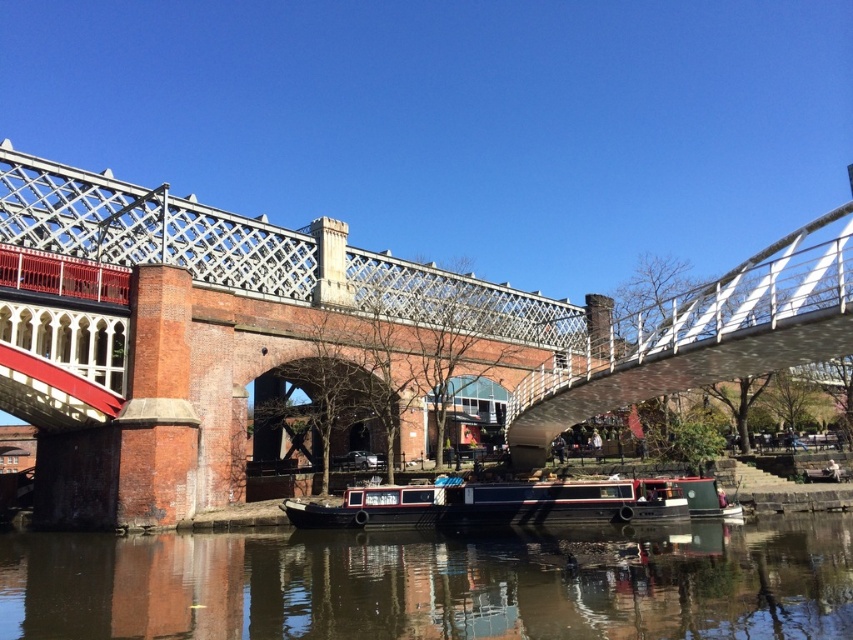
Question: Considering the relative positions of brown reflective water at center and black polished wood boat at center in the image provided, where is brown reflective water at center located with respect to black polished wood boat at center?

Choices:
 (A) right
 (B) left

Answer: (B)

Question: In this image, where is metallic silver pedestrian bridge at center located relative to brown reflective water at center?

Choices:
 (A) above
 (B) below

Answer: (A)

Question: Among these points, which one is nearest to the camera?

Choices:
 (A) (312, 513)
 (B) (276, 356)
 (C) (633, 577)

Answer: (C)

Question: Which point is closer to the camera taking this photo?

Choices:
 (A) (373, 509)
 (B) (375, 552)

Answer: (B)

Question: Which object is closer to the camera taking this photo?

Choices:
 (A) black polished wood boat at center
 (B) metallic silver pedestrian bridge at center

Answer: (B)

Question: Can you confirm if brown reflective water at center is positioned above black polished wood boat at center?

Choices:
 (A) no
 (B) yes

Answer: (A)